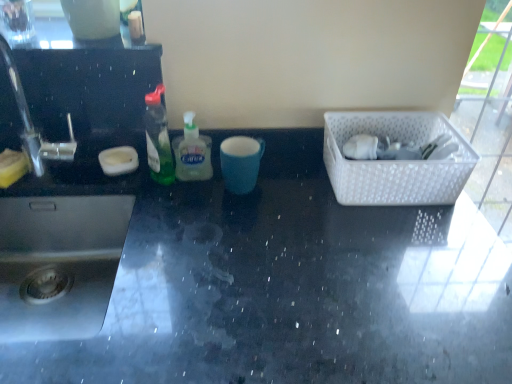
This screenshot has height=384, width=512. Find the location of `vacant space situated on the left part of green translucent bottle at center, acting as the 2th bottle starting from the right`. vacant space situated on the left part of green translucent bottle at center, acting as the 2th bottle starting from the right is located at coordinates (94, 178).